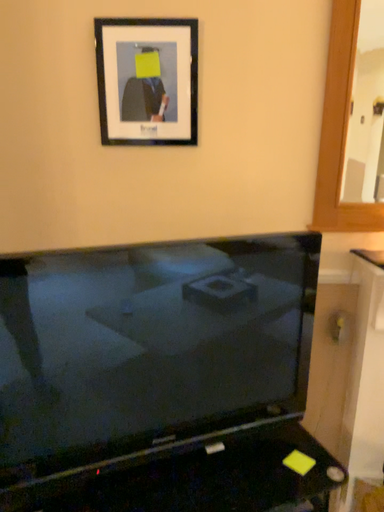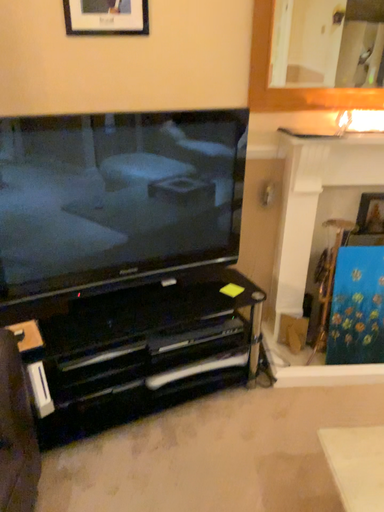
Question: Which way did the camera rotate in the video?

Choices:
 (A) rotated downward
 (B) rotated upward

Answer: (A)